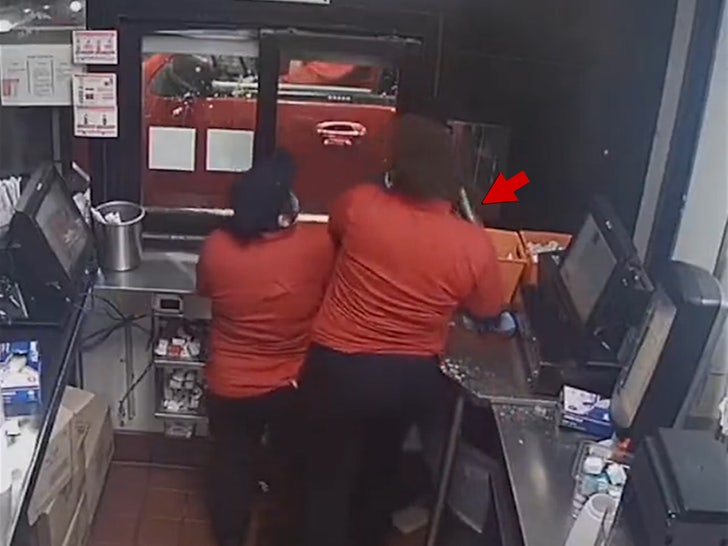
You are a GUI agent. You are given a task and a screenshot of the screen. Output one action in this format:
    pyautogui.click(x=<x>, y=<y>)
    Task: Click on the computer
    The height and width of the screenshot is (546, 728).
    Given the screenshot: What is the action you would take?
    (54, 234)